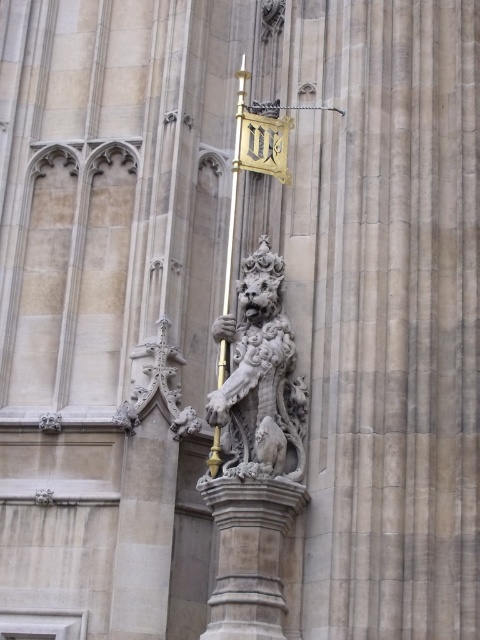
You are an art student analyzing the stone building. You notice two lion sculptures, the white stone lion at center and the carved stone lion at center. Which one is larger in size?

The white stone lion at center is bigger than the carved stone lion at center.

You are an architect examining the stone building. You notice the carved stone lion at center and the gold polished metal pole at center. Which object is positioned higher in the scene?

The gold polished metal pole at center is positioned higher than the carved stone lion at center because the carved stone lion at center is below the gold polished metal pole at center.

You are an architect designing a new historical building and want to replicate the proportions between the white stone lion at center and the gold polished metal pole at center seen in the image. Based on the scene, which object should be made smaller to maintain the original proportions?

The white stone lion at center is smaller than the gold polished metal pole at center in the original image, so to maintain proportions, the white stone lion at center should remain smaller than the gold polished metal pole at center.